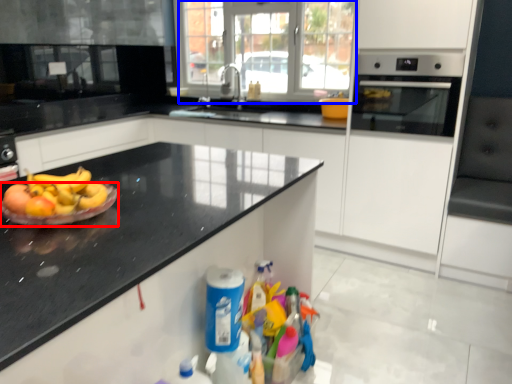
Question: Which object appears closest to the camera in this image, paper plate (highlighted by a red box) or glass door (highlighted by a blue box)?

Choices:
 (A) paper plate
 (B) glass door

Answer: (A)